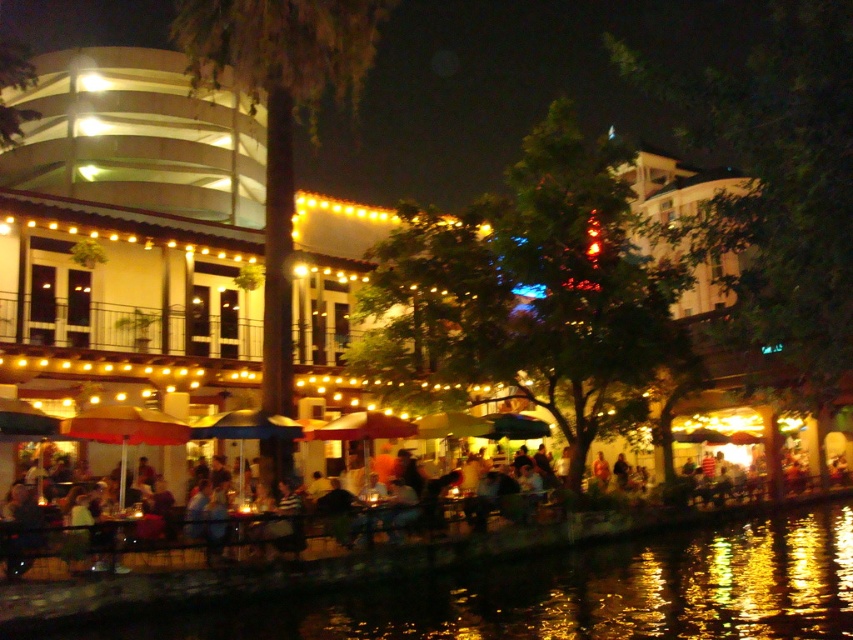
Which of these two, black reflective water at lower center or matte black umbrella at lower center, stands shorter?

black reflective water at lower center

Is black reflective water at lower center further to the viewer compared to matte black umbrella at lower center?

No, it is not.

Is point (526, 547) closer to camera compared to point (105, 528)?

That is False.

Identify the location of black reflective water at lower center. This screenshot has height=640, width=853. (305, 573).